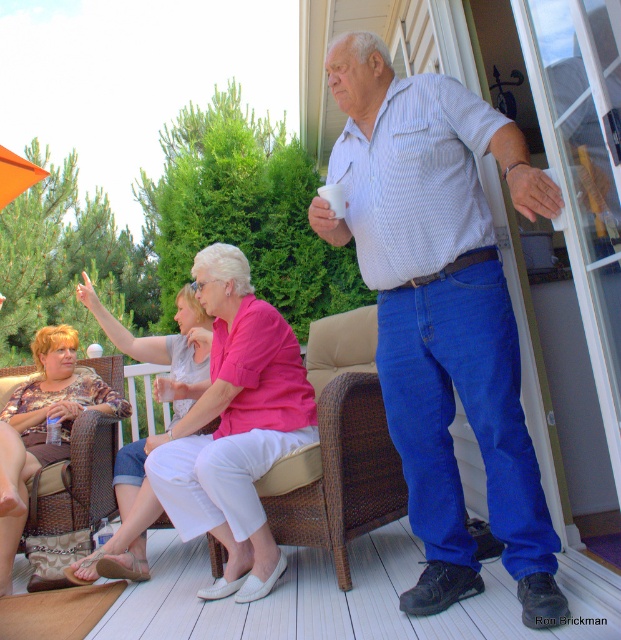
Question: Does white wood deck at lower center appear over orange matte umbrella at upper left?

Choices:
 (A) yes
 (B) no

Answer: (B)

Question: Which point is farther to the camera?

Choices:
 (A) (360, 616)
 (B) (271, 516)

Answer: (B)

Question: Which of the following is the closest to the observer?

Choices:
 (A) woven brown chair at center
 (B) matte pink blouse at center
 (C) striped cotton shirt at upper right
 (D) white wood deck at lower center

Answer: (C)

Question: Which of the following is the closest to the observer?

Choices:
 (A) (20, 177)
 (B) (143, 499)
 (C) (27, 468)

Answer: (B)

Question: Can you confirm if woven brown chair at center is positioned above matte pink blouse at center?

Choices:
 (A) yes
 (B) no

Answer: (B)

Question: Is white wood deck at lower center wider than woven brown chair at center?

Choices:
 (A) no
 (B) yes

Answer: (B)